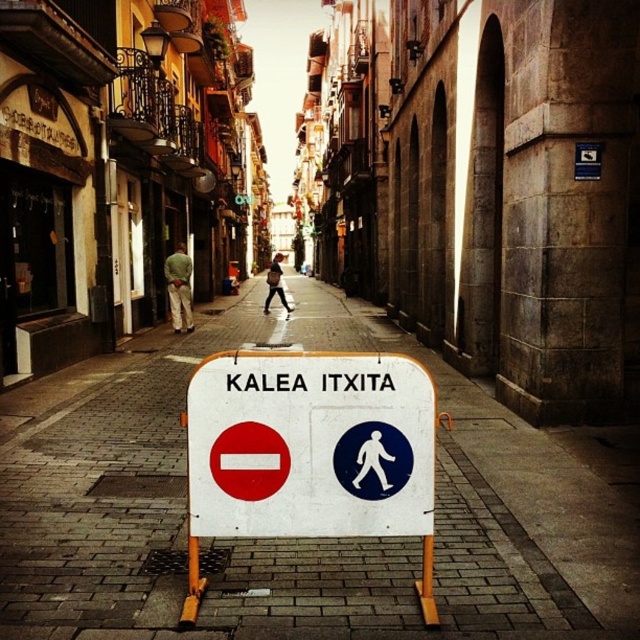
Is white brick pavement at center shorter than white plastic sign at center?

Yes.

Does white brick pavement at center appear on the left side of white plastic sign at center?

Yes, white brick pavement at center is to the left of white plastic sign at center.

Which is behind, point (294, 584) or point (205, 500)?

The point (294, 584) is more distant.

Identify the location of white brick pavement at center. Image resolution: width=640 pixels, height=640 pixels. (298, 540).